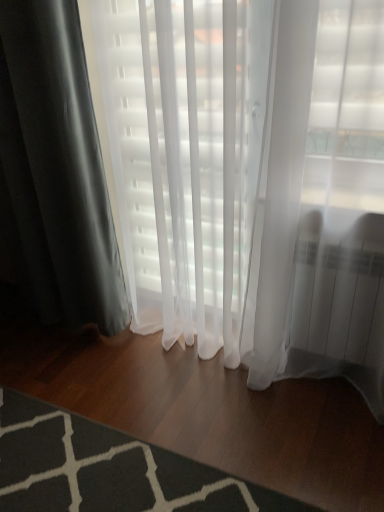
Locate an element on the screen. free space below matte black curtain at left (from a real-world perspective) is located at coordinates (68, 330).